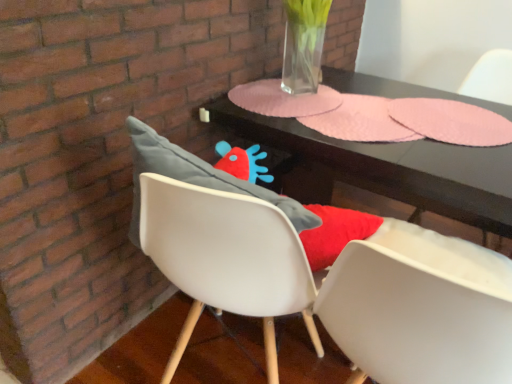
Image resolution: width=512 pixels, height=384 pixels. Identify the location of free region under pink paper placemats at center (from a real-world perspective). (389, 122).